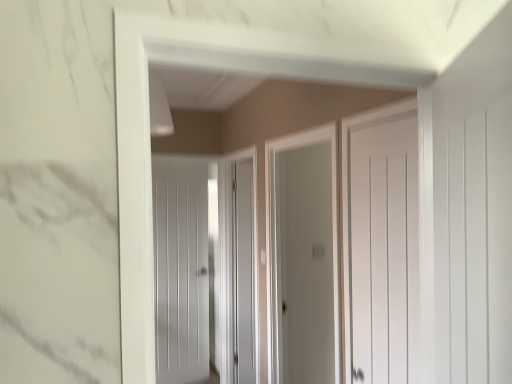
Question: Looking at the image, does matte gray screen door at center, arranged as the 2th screen door when viewed from the front, seem bigger or smaller compared to clear glass door at center, marked as the 2th screen door in a left-to-right arrangement?

Choices:
 (A) small
 (B) big

Answer: (B)

Question: Visually, is matte gray screen door at center, placed as the first screen door when sorted from back to front, positioned to the left or to the right of clear glass door at center, acting as the 1th screen door starting from the front?

Choices:
 (A) right
 (B) left

Answer: (B)

Question: Based on their relative distances, which object is farther from the white matte door at center, the 1th door from the left?

Choices:
 (A) white matte door at center, placed as the 2th door when sorted from back to front
 (B) clear glass door at center, marked as the 2th screen door in a left-to-right arrangement
 (C) matte gray screen door at center, which appears as the 1th screen door when viewed from the left

Answer: (A)

Question: Considering the real-world distances, which object is farthest from the clear glass door at center, positioned as the 2th screen door in back-to-front order?

Choices:
 (A) white matte door at center, which is the 1th door in front-to-back order
 (B) matte gray screen door at center, marked as the 2th screen door in a right-to-left arrangement
 (C) white matte door at center, the 1th door from the left

Answer: (C)